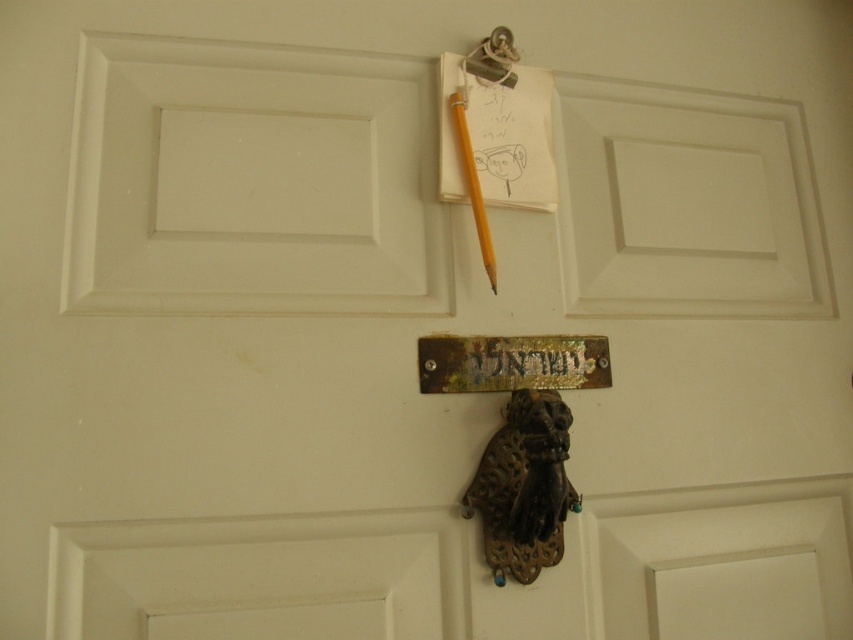
Question: Which object is positioned closest to the yellow wood pencil at center?

Choices:
 (A) rusty metal sign at center
 (B) antique brass knocker at center
 (C) metallic hook at upper center

Answer: (C)

Question: Is gold metallic sign at center closer to camera compared to yellow wood pencil at center?

Choices:
 (A) yes
 (B) no

Answer: (B)

Question: Can you confirm if rusty metal sign at center is bigger than gold metallic sign at center?

Choices:
 (A) yes
 (B) no

Answer: (A)

Question: Which point is farther to the camera?

Choices:
 (A) (547, 371)
 (B) (491, 38)
 (C) (566, 340)

Answer: (B)

Question: Considering the real-world distances, which object is farthest from the antique brass knocker at center?

Choices:
 (A) rusty metal sign at center
 (B) yellow wood pencil at center

Answer: (B)

Question: Can you confirm if yellow wood pencil at center is positioned to the left of metallic hook at upper center?

Choices:
 (A) yes
 (B) no

Answer: (A)